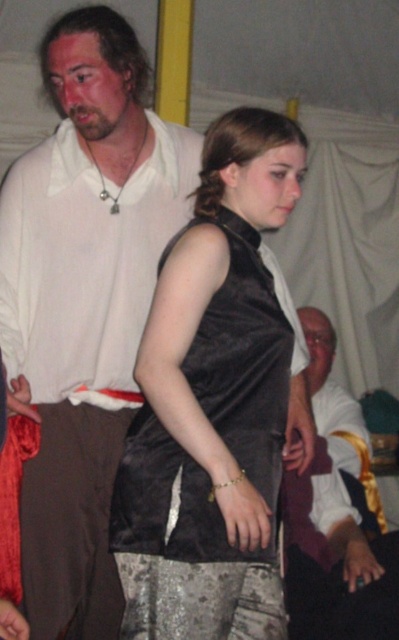
Based on the coordinates provided, which object is located at point (x=82, y=308) in the image?

The matte white shirt at upper left is located at point (x=82, y=308).

In the scene shown: Based on the scene description, what object is positioned at the coordinates point (215, 404)?

The satin black vest at center is located at point (215, 404).

You are at a costume party and want to know the order of clothing layers for two characters. The satin black vest at center is worn by a woman, and the silky white shirt at center belongs to a man. Which clothing item is visible on top?

The satin black vest at center is positioned over the silky white shirt at center, so the black vest is visible on top.